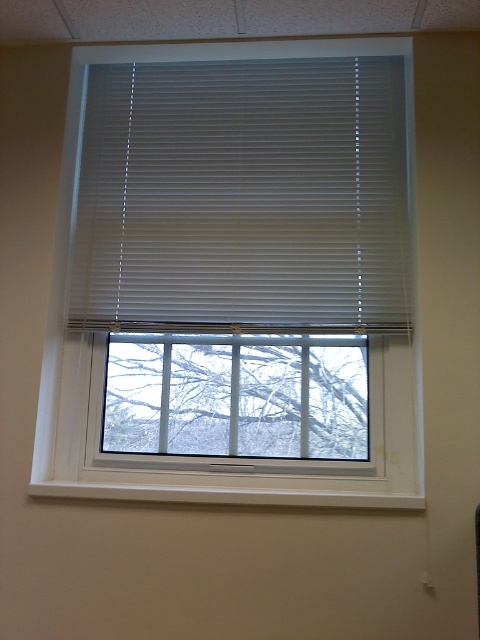
Can you confirm if white matte blinds at center is taller than clear glass window at center?

Yes, white matte blinds at center is taller than clear glass window at center.

Is white matte blinds at center positioned before clear glass window at center?

Yes, white matte blinds at center is closer to the viewer.

Does point (345, 196) come closer to viewer compared to point (348, 422)?

No, it is behind (348, 422).

You are a GUI agent. You are given a task and a screenshot of the screen. Output one action in this format:
    pyautogui.click(x=<x>, y=<y>)
    Task: Click on the white matte blinds at center
    Image resolution: width=480 pixels, height=640 pixels.
    Given the screenshot: What is the action you would take?
    pyautogui.click(x=243, y=196)